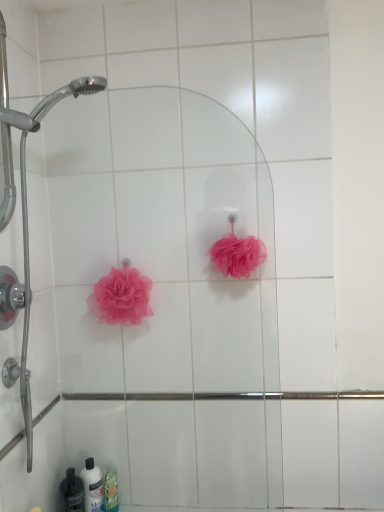
Question: Can you confirm if white glossy bottle at lower left, which is the second toiletry in right-to-left order, is wider than pink mesh sponge at lower left, marked as the 1th rose in a left-to-right arrangement?

Choices:
 (A) no
 (B) yes

Answer: (A)

Question: Does white glossy bottle at lower left, which is the second toiletry in right-to-left order, lie in front of pink mesh sponge at lower left, marked as the 1th rose in a left-to-right arrangement?

Choices:
 (A) no
 (B) yes

Answer: (A)

Question: Can pink mesh sponge at lower left, marked as the 1th rose in a left-to-right arrangement, be found inside white glossy bottle at lower left, which is the 2th toiletry in left-to-right order?

Choices:
 (A) yes
 (B) no

Answer: (B)

Question: From a real-world perspective, is white glossy bottle at lower left, which is the 2th toiletry in left-to-right order, under pink mesh sponge at lower left, which appears as the 2th rose when viewed from the right?

Choices:
 (A) yes
 (B) no

Answer: (A)

Question: Does white glossy bottle at lower left, which is the second toiletry in right-to-left order, have a larger size compared to pink mesh sponge at lower left, marked as the 1th rose in a left-to-right arrangement?

Choices:
 (A) yes
 (B) no

Answer: (B)

Question: Are white glossy bottle at lower left, which is the second toiletry in right-to-left order, and pink mesh sponge at lower left, marked as the 1th rose in a left-to-right arrangement, far apart?

Choices:
 (A) yes
 (B) no

Answer: (B)

Question: Does white glossy bottle at lower left, which is the 2th toiletry in left-to-right order, contain pink mesh sponge at upper center?

Choices:
 (A) yes
 (B) no

Answer: (B)

Question: Considering the relative sizes of white glossy bottle at lower left, which is the 2th toiletry in left-to-right order, and pink mesh sponge at upper center in the image provided, is white glossy bottle at lower left, which is the 2th toiletry in left-to-right order, smaller than pink mesh sponge at upper center?

Choices:
 (A) yes
 (B) no

Answer: (A)

Question: Considering the relative sizes of white glossy bottle at lower left, which is the second toiletry in right-to-left order, and pink mesh sponge at upper center in the image provided, is white glossy bottle at lower left, which is the second toiletry in right-to-left order, bigger than pink mesh sponge at upper center?

Choices:
 (A) no
 (B) yes

Answer: (A)

Question: Is white glossy bottle at lower left, which is the second toiletry in right-to-left order, to the left of pink mesh sponge at upper center from the viewer's perspective?

Choices:
 (A) no
 (B) yes

Answer: (B)

Question: Is white glossy bottle at lower left, which is the second toiletry in right-to-left order, completely or partially outside of pink mesh sponge at upper center?

Choices:
 (A) yes
 (B) no

Answer: (A)

Question: Can you confirm if white glossy bottle at lower left, which is the second toiletry in right-to-left order, is thinner than pink mesh sponge at upper center?

Choices:
 (A) yes
 (B) no

Answer: (B)

Question: Considering the relative sizes of pink mesh sponge at center, the 2th rose viewed from the left, and white glossy bottle at lower left, which is the second toiletry in right-to-left order, in the image provided, is pink mesh sponge at center, the 2th rose viewed from the left, bigger than white glossy bottle at lower left, which is the second toiletry in right-to-left order,?

Choices:
 (A) yes
 (B) no

Answer: (A)